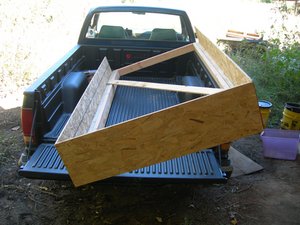
Where is `bed`? This screenshot has width=300, height=225. bed is located at coordinates (138, 109).